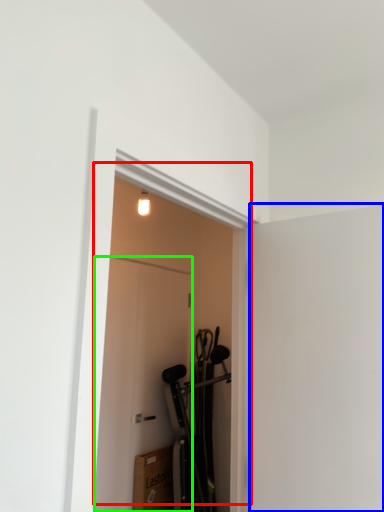
Question: Which is nearer to the door (highlighted by a red box)? screen door (highlighted by a blue box) or door (highlighted by a green box).

Choices:
 (A) screen door
 (B) door

Answer: (B)